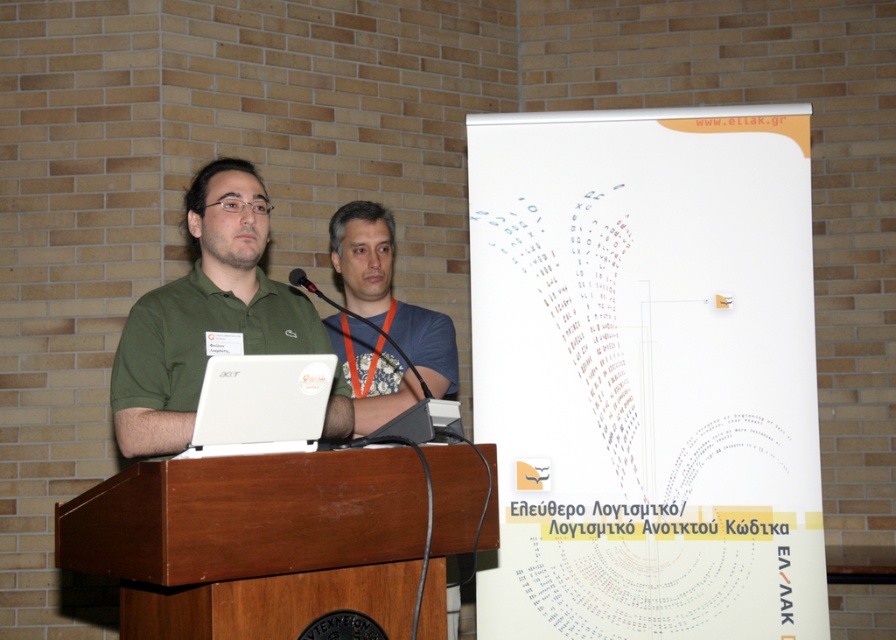
Question: Is brown wood podium at center closer to camera compared to black plastic microphone at center?

Choices:
 (A) yes
 (B) no

Answer: (A)

Question: Which object appears farthest from the camera in this image?

Choices:
 (A) matte black microphone at center
 (B) green matte shirt at center
 (C) black plastic microphone at center

Answer: (C)

Question: In this image, where is green matte shirt at center located relative to white matte laptop at center?

Choices:
 (A) above
 (B) below

Answer: (A)

Question: Which is farther from the white matte laptop at center?

Choices:
 (A) black plastic microphone at center
 (B) green matte shirt at center
 (C) matte black microphone at center
 (D) brown wood podium at center

Answer: (A)

Question: Is brown wood podium at center wider than green matte shirt at center?

Choices:
 (A) no
 (B) yes

Answer: (B)

Question: Which point appears farthest from the camera in this image?

Choices:
 (A) (x=300, y=449)
 (B) (x=299, y=280)
 (C) (x=234, y=282)

Answer: (C)